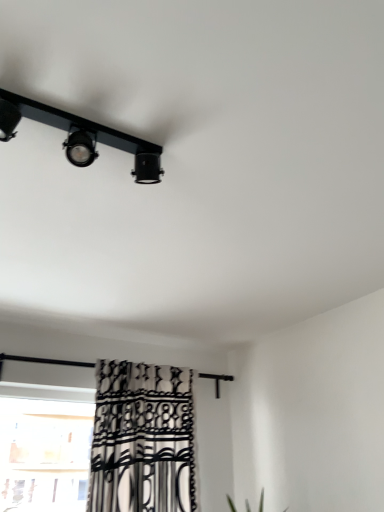
Identify the location of black matte track light at upper left. (81, 136).

Describe the element at coordinates (81, 136) in the screenshot. Image resolution: width=384 pixels, height=512 pixels. I see `black matte track light at upper left` at that location.

Measure the distance between point (182, 394) and camera.

The distance of point (182, 394) from camera is 8.46 feet.

This screenshot has width=384, height=512. In order to click on black and white patterned curtain at lower left in this screenshot , I will do `click(143, 439)`.

Describe the element at coordinates (143, 439) in the screenshot. I see `black and white patterned curtain at lower left` at that location.

What is the approximate height of black and white patterned curtain at lower left?

The height of black and white patterned curtain at lower left is 32.19 inches.

Where is `black matte track light at upper left`? black matte track light at upper left is located at coordinates (81, 136).

Considering the relative positions of black matte track light at upper left and black and white patterned curtain at lower left in the image provided, is black matte track light at upper left to the left or to the right of black and white patterned curtain at lower left?

In the image, black matte track light at upper left appears on the left side of black and white patterned curtain at lower left.

Relative to black and white patterned curtain at lower left, is black matte track light at upper left in front or behind?

Visually, black matte track light at upper left is located in front of black and white patterned curtain at lower left.

Which point is more distant from viewer, (17, 101) or (119, 503)?

The point (119, 503) is behind.

From the image's perspective, is black matte track light at upper left located beneath black and white patterned curtain at lower left?

No.

From a real-world perspective, is black matte track light at upper left above or below black and white patterned curtain at lower left?

From a real-world perspective, black matte track light at upper left is physically above black and white patterned curtain at lower left.

From the picture: Between black matte track light at upper left and black and white patterned curtain at lower left, which one has larger width?

Wider between the two is black and white patterned curtain at lower left.

From their relative heights in the image, would you say black matte track light at upper left is taller or shorter than black and white patterned curtain at lower left?

Considering their sizes, black matte track light at upper left has less height than black and white patterned curtain at lower left.

Who is smaller, black matte track light at upper left or black and white patterned curtain at lower left?

With smaller size is black matte track light at upper left.

Is black matte track light at upper left inside the boundaries of black and white patterned curtain at lower left, or outside?

black matte track light at upper left is not inside black and white patterned curtain at lower left, it's outside.

Is black matte track light at upper left next to black and white patterned curtain at lower left and touching it?

No, black matte track light at upper left is not next to black and white patterned curtain at lower left.

Is black matte track light at upper left facing away from black and white patterned curtain at lower left?

That's not correct — black matte track light at upper left is not looking away from black and white patterned curtain at lower left.

What's the angular difference between black matte track light at upper left and black and white patterned curtain at lower left's facing directions?

The angular difference between black matte track light at upper left and black and white patterned curtain at lower left is 0.000202 degrees.

How much distance is there between black matte track light at upper left and black and white patterned curtain at lower left?

A distance of 5.57 feet exists between black matte track light at upper left and black and white patterned curtain at lower left.

Identify the location of curtain behind the black matte track light at upper left. The image size is (384, 512). (143, 439).

Is black and white patterned curtain at lower left to the left of black matte track light at upper left from the viewer's perspective?

No.

Which object is closer to the camera taking this photo, black and white patterned curtain at lower left or black matte track light at upper left?

black matte track light at upper left is closer to the camera.

Does point (180, 441) appear closer or farther from the camera than point (26, 111)?

Point (180, 441) appears to be farther away from the viewer than point (26, 111).

From the image's perspective, between black and white patterned curtain at lower left and black matte track light at upper left, who is located below?

black and white patterned curtain at lower left appears lower in the image.

From a real-world perspective, is black and white patterned curtain at lower left beneath black matte track light at upper left?

Yes.

Looking at their sizes, would you say black and white patterned curtain at lower left is wider or thinner than black matte track light at upper left?

In the image, black and white patterned curtain at lower left appears to be wider than black matte track light at upper left.

Does black and white patterned curtain at lower left have a greater height compared to black matte track light at upper left?

Yes.

Can you confirm if black and white patterned curtain at lower left is smaller than black matte track light at upper left?

No, black and white patterned curtain at lower left is not smaller than black matte track light at upper left.

Is black and white patterned curtain at lower left not inside black matte track light at upper left?

That's correct, black and white patterned curtain at lower left is outside of black matte track light at upper left.

Is the surface of black and white patterned curtain at lower left in direct contact with black matte track light at upper left?

No, black and white patterned curtain at lower left is not next to black matte track light at upper left.

Is black and white patterned curtain at lower left facing away from black matte track light at upper left?

No.

How many degrees apart are the facing directions of black and white patterned curtain at lower left and black matte track light at upper left?

The angular difference between black and white patterned curtain at lower left and black matte track light at upper left is 0.000202 degrees.

How far apart are black and white patterned curtain at lower left and black matte track light at upper left?

1.70 meters.

Locate an element on the screen. The height and width of the screenshot is (512, 384). lamp located in front of the black and white patterned curtain at lower left is located at coordinates (81, 136).

Find the location of a particular element. This screenshot has width=384, height=512. curtain lying below the black matte track light at upper left (from the image's perspective) is located at coordinates (143, 439).

What are the coordinates of `lamp that appears in front of the black and white patterned curtain at lower left` in the screenshot? It's located at (81, 136).